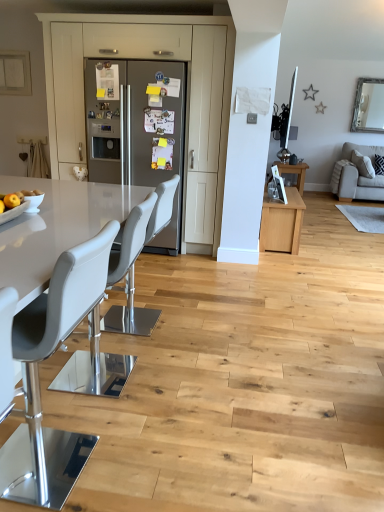
Where is `free space in front of white leather chair at center, the 1th chair viewed from the back`? free space in front of white leather chair at center, the 1th chair viewed from the back is located at coordinates (143, 349).